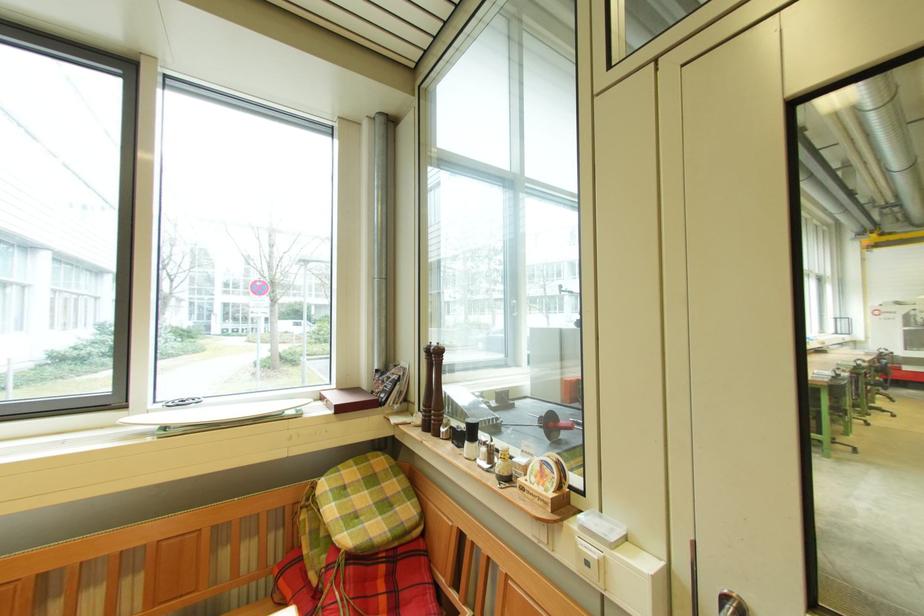
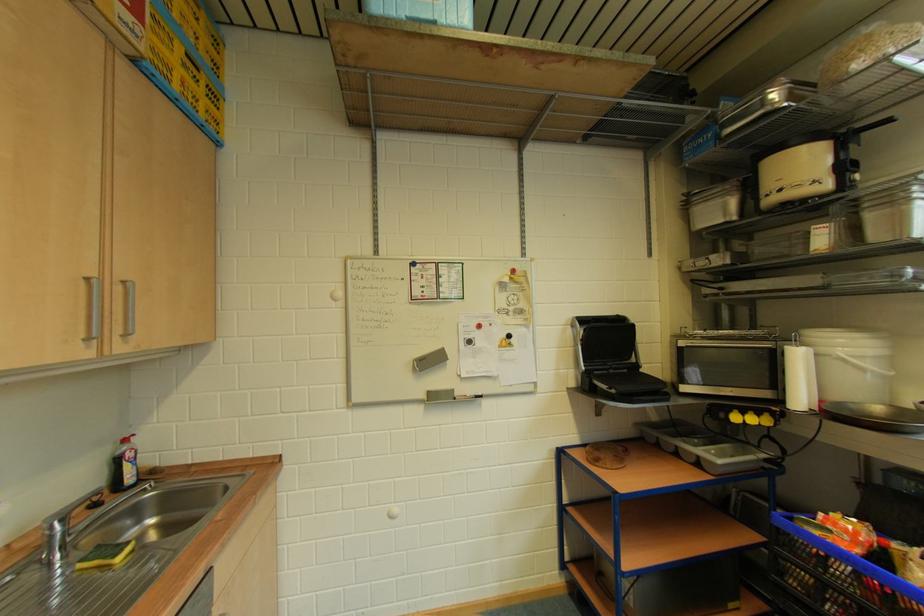
Question: The camera is either moving clockwise (left) or counter-clockwise (right) around the object. The first image is from the beginning of the video and the second image is from the end. Is the camera moving left or right when shooting the video?

Choices:
 (A) Left
 (B) Right

Answer: (B)